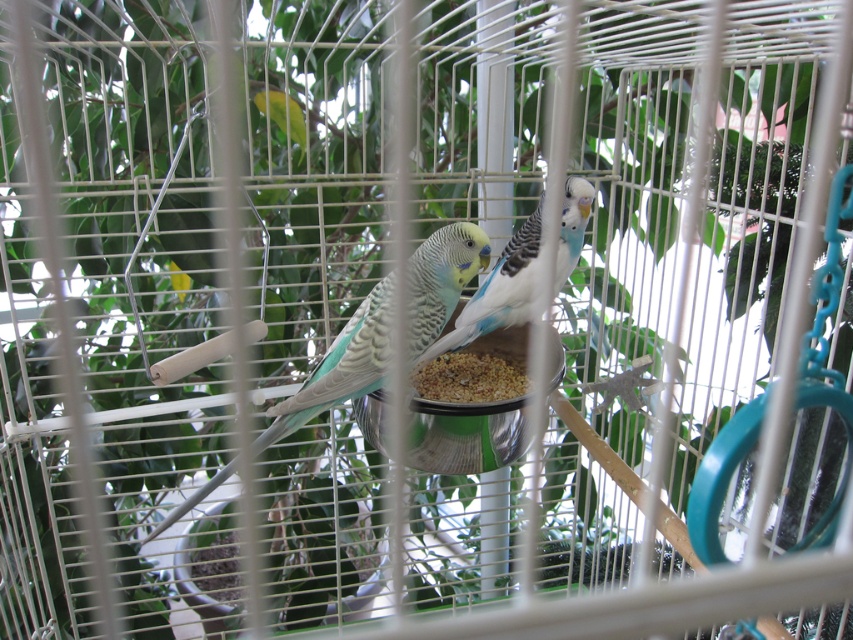
Question: Which object is the closest to the brown grainy food at center?

Choices:
 (A) blue and white parrot at center
 (B) speckled teal parrot at center
 (C) metallic silver bird feeder at center

Answer: (C)

Question: Which is nearer to the blue and white parrot at center?

Choices:
 (A) speckled teal parrot at center
 (B) metallic silver bird feeder at center

Answer: (A)

Question: Which point appears closest to the camera in this image?

Choices:
 (A) (448, 266)
 (B) (573, 195)

Answer: (A)

Question: Is metallic silver bird feeder at center positioned before brown grainy food at center?

Choices:
 (A) no
 (B) yes

Answer: (B)

Question: Is speckled teal parrot at center positioned behind metallic silver bird feeder at center?

Choices:
 (A) yes
 (B) no

Answer: (B)

Question: Is the position of metallic silver bird feeder at center less distant than that of blue and white parrot at center?

Choices:
 (A) no
 (B) yes

Answer: (B)